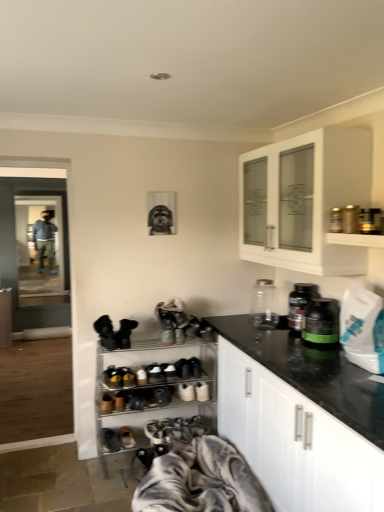
Question: Is brown suede shoe at lower center, positioned as the 3th footwear in top-to-bottom order, situated inside transparent glass jar at right or outside?

Choices:
 (A) inside
 (B) outside

Answer: (B)

Question: Looking at their shapes, would you say brown suede shoe at lower center, positioned as the 3th footwear in top-to-bottom order, is wider or thinner than transparent glass jar at right?

Choices:
 (A) wide
 (B) thin

Answer: (A)

Question: Which of these objects is positioned farthest from the gray textured blanket at lower center?

Choices:
 (A) green plastic container at upper right
 (B) brown suede shoe at lower center, positioned as the 3th footwear in top-to-bottom order
 (C) white glossy shelf at upper right, the second shelf in the left-to-right sequence
 (D) black suede shoes at center, which is counted as the fifth footwear, starting from the bottom
 (E) transparent glass jar at right

Answer: (C)

Question: Based on their relative distances, which object is farther from the white matte cabinet at lower right, acting as the first cabinetry starting from the right?

Choices:
 (A) black plastic bottle at upper right
 (B) black suede shoe at lower left, the first shoe from the left
 (C) white glossy cabinet at upper right, which is the second cabinetry in right-to-left order
 (D) metallic shoe rack at lower center, which appears as the 1th shelf when ordered from the bottom
 (E) black suede shoes at center, which is counted as the 1th footwear, starting from the top

Answer: (B)